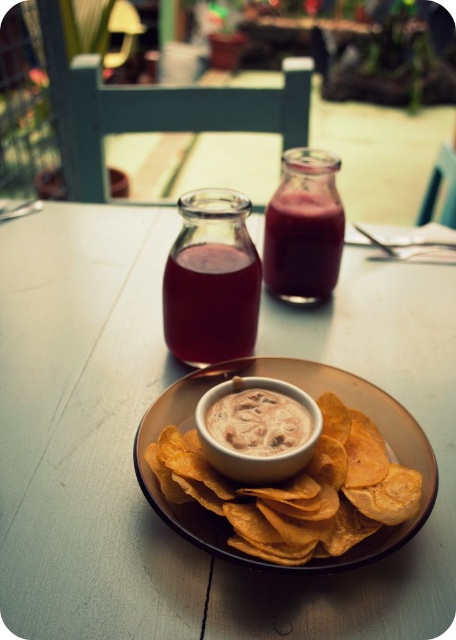
Question: Does wooden table at center appear over golden crispy chips at center?

Choices:
 (A) no
 (B) yes

Answer: (B)

Question: Which point is closer to the camera?

Choices:
 (A) (99, 310)
 (B) (307, 266)
 (C) (276, 435)
 (D) (201, 344)

Answer: (C)

Question: Where is wooden table at center located in relation to white creamy dip at center in the image?

Choices:
 (A) below
 (B) above

Answer: (B)

Question: Which of the following is the farthest from the observer?

Choices:
 (A) (317, 248)
 (B) (224, 358)

Answer: (A)

Question: Can you confirm if golden crispy chips at center is bigger than smooth glass jar at center?

Choices:
 (A) yes
 (B) no

Answer: (A)

Question: Which point appears closest to the camera in this image?

Choices:
 (A) (332, 554)
 (B) (290, 237)
 (C) (259, 224)
 (D) (243, 428)

Answer: (A)